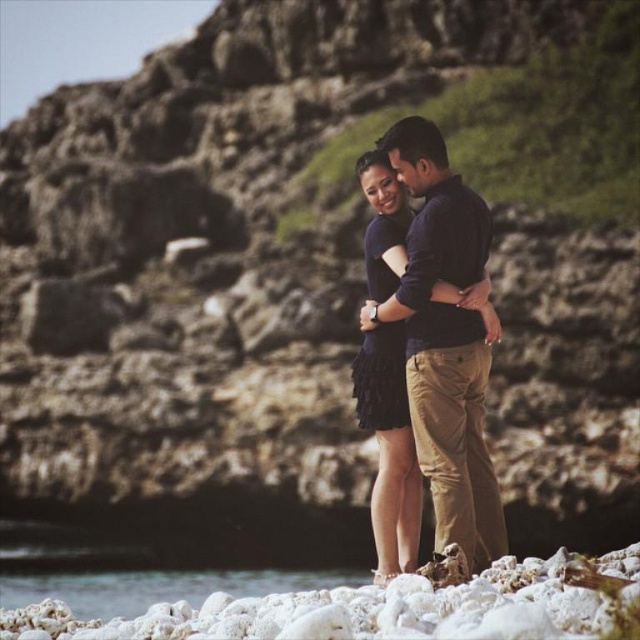
Consider the image. You are a photographer positioned at the origin point of the image. You want to focus your camera on the dark blue cotton shirt at center. What are the coordinates where you should aim your lens?

The dark blue cotton shirt at center is located at point [445,340], so you should aim your lens at those coordinates to focus on it.

You are standing in front of the rocky shoreline scene and want to determine which of the two points, point (637, 545) or point (426, 394), is nearer to you. Based on the image, which point is closer?

Point (637, 545) is closer to the viewer than point (426, 394).